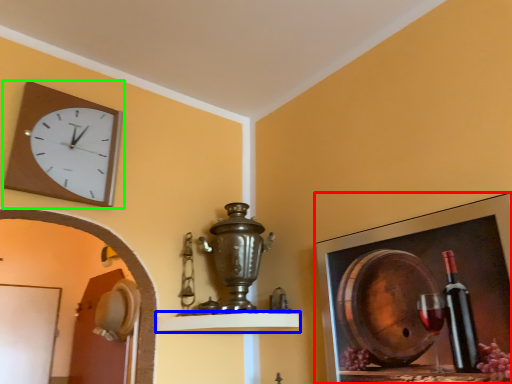
Question: Which object is the farthest from picture frame (highlighted by a red box)? Choose among these: shelf (highlighted by a blue box) or wall clock (highlighted by a green box).

Choices:
 (A) shelf
 (B) wall clock

Answer: (B)